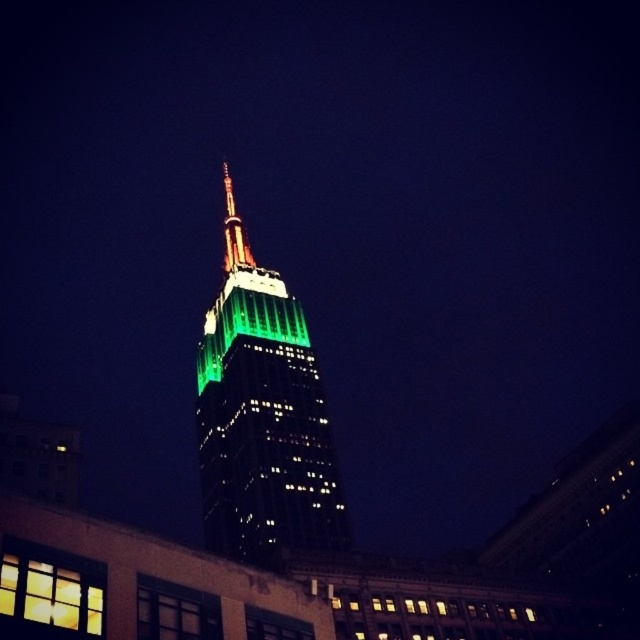
Question: Can you confirm if green glass tower at center is positioned to the left of shiny metallic spire at center?

Choices:
 (A) yes
 (B) no

Answer: (B)

Question: Which object appears closest to the camera in this image?

Choices:
 (A) green glass tower at center
 (B) shiny metallic spire at center

Answer: (A)

Question: Which point is farther from the camera taking this photo?

Choices:
 (A) (225, 172)
 (B) (342, 532)

Answer: (A)

Question: Is green glass tower at center bigger than shiny metallic spire at center?

Choices:
 (A) yes
 (B) no

Answer: (A)

Question: Does green glass tower at center have a greater width compared to shiny metallic spire at center?

Choices:
 (A) no
 (B) yes

Answer: (B)